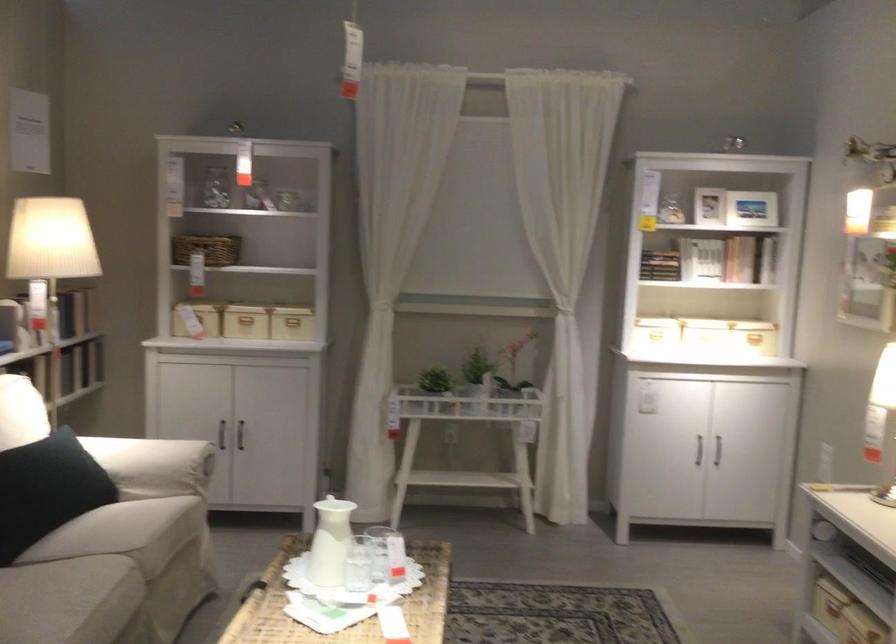
Describe the element at coordinates (47, 489) in the screenshot. I see `the dark throw pillow` at that location.